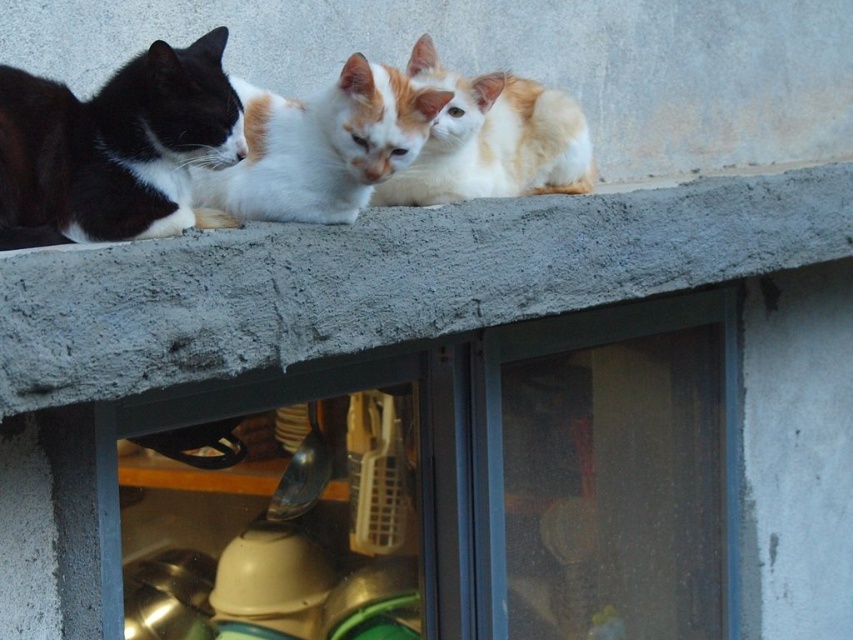
You are a bird flying outside the window. You see the transparent plastic window at center and the orange and white fur at upper center. Which object is closer to you?

The transparent plastic window at center is closer to you because the orange and white fur at upper center is behind it.

You are a photographer trying to capture a clear shot of the transparent plastic window at center and the white fur cat at center. Since you want to focus on the window, which object should you adjust your camera focus to prioritize? Please explain your reasoning based on their sizes.

The transparent plastic window at center is larger in size than the white fur cat at center. To prioritize focusing on the window, adjust the camera focus to the transparent plastic window at center because it occupies more of the frame due to its larger size.

You are a cat lover observing the three cats on the concrete ledge. You want to know which cat is closest to the transparent plastic window at center. Can you determine this based on their positions?

The calico cat in the center is closest to the transparent plastic window at center because it is positioned directly in front of the window.